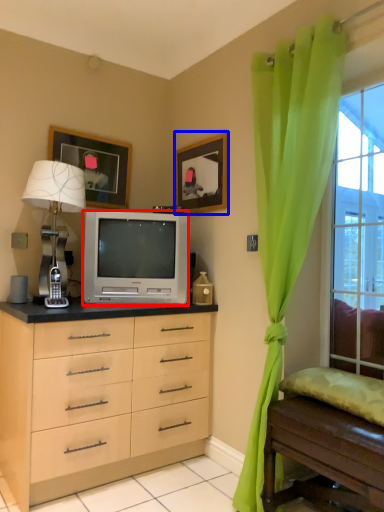
Question: Which of the following is the closest to the observer, television (highlighted by a red box) or picture frame (highlighted by a blue box)?

Choices:
 (A) television
 (B) picture frame

Answer: (A)